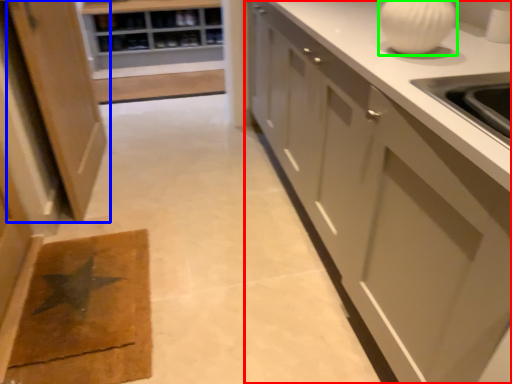
Question: Which object is positioned farthest from cabinetry (highlighted by a red box)? Select from cabinetry (highlighted by a blue box) and marble (highlighted by a green box).

Choices:
 (A) cabinetry
 (B) marble

Answer: (A)